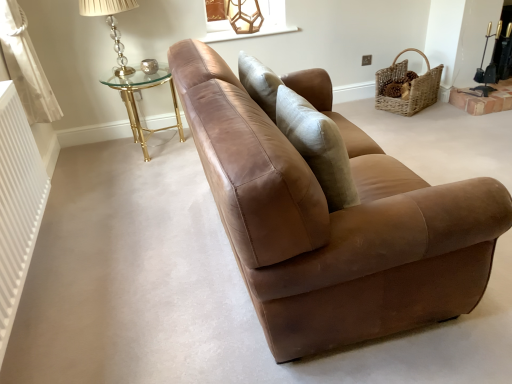
Question: Does translucent glass lampshade at upper left, positioned as the first table lamp in left-to-right order, lie behind white ribbed radiator at left?

Choices:
 (A) yes
 (B) no

Answer: (A)

Question: Is translucent glass lampshade at upper left, the 2th table lamp positioned from the right, positioned in front of white ribbed radiator at left?

Choices:
 (A) yes
 (B) no

Answer: (B)

Question: Would you consider translucent glass lampshade at upper left, the first table lamp positioned from the front, to be distant from white ribbed radiator at left?

Choices:
 (A) no
 (B) yes

Answer: (B)

Question: Is translucent glass lampshade at upper left, the 2th table lamp positioned from the right, wider than white ribbed radiator at left?

Choices:
 (A) no
 (B) yes

Answer: (B)

Question: Can you confirm if translucent glass lampshade at upper left, the 2th table lamp positioned from the right, is positioned to the left of white ribbed radiator at left?

Choices:
 (A) no
 (B) yes

Answer: (A)

Question: Would you say gold metallic glass table at upper left is to the left or to the right of metallic glass table lamp at upper center, the second table lamp positioned from the front, in the picture?

Choices:
 (A) right
 (B) left

Answer: (B)

Question: Does point (134, 109) appear closer or farther from the camera than point (231, 18)?

Choices:
 (A) closer
 (B) farther

Answer: (B)

Question: In the image, is gold metallic glass table at upper left positioned in front of or behind metallic glass table lamp at upper center, the second table lamp positioned from the front?

Choices:
 (A) behind
 (B) front

Answer: (B)

Question: Is gold metallic glass table at upper left wider or thinner than metallic glass table lamp at upper center, which is the first table lamp in right-to-left order?

Choices:
 (A) thin
 (B) wide

Answer: (B)

Question: Considering the positions of metallic glass table lamp at upper center, which appears as the first table lamp when viewed from the back, and white fabric curtain at left in the image, is metallic glass table lamp at upper center, which appears as the first table lamp when viewed from the back, wider or thinner than white fabric curtain at left?

Choices:
 (A) thin
 (B) wide

Answer: (B)

Question: Is point (244, 19) closer or farther from the camera than point (30, 86)?

Choices:
 (A) closer
 (B) farther

Answer: (B)

Question: In terms of height, does metallic glass table lamp at upper center, the 2th table lamp viewed from the left, look taller or shorter compared to white fabric curtain at left?

Choices:
 (A) tall
 (B) short

Answer: (B)

Question: From a real-world perspective, is metallic glass table lamp at upper center, the second table lamp positioned from the front, above or below white fabric curtain at left?

Choices:
 (A) below
 (B) above

Answer: (B)

Question: Is woven natural basket at upper right in front of or behind white fabric curtain at left in the image?

Choices:
 (A) behind
 (B) front

Answer: (A)

Question: From a real-world perspective, relative to white fabric curtain at left, is woven natural basket at upper right vertically above or below?

Choices:
 (A) below
 (B) above

Answer: (A)